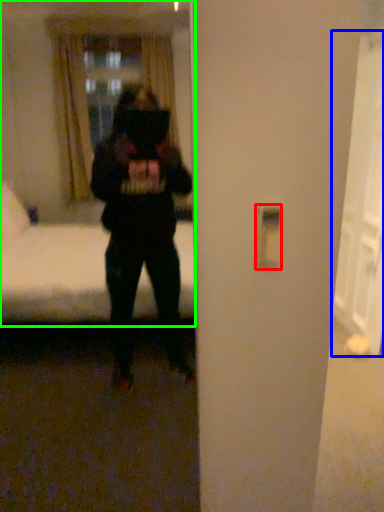
Question: Which object is the closest to the light switch (highlighted by a red box)? Choose among these: glass door (highlighted by a blue box) or mirror (highlighted by a green box).

Choices:
 (A) glass door
 (B) mirror

Answer: (A)